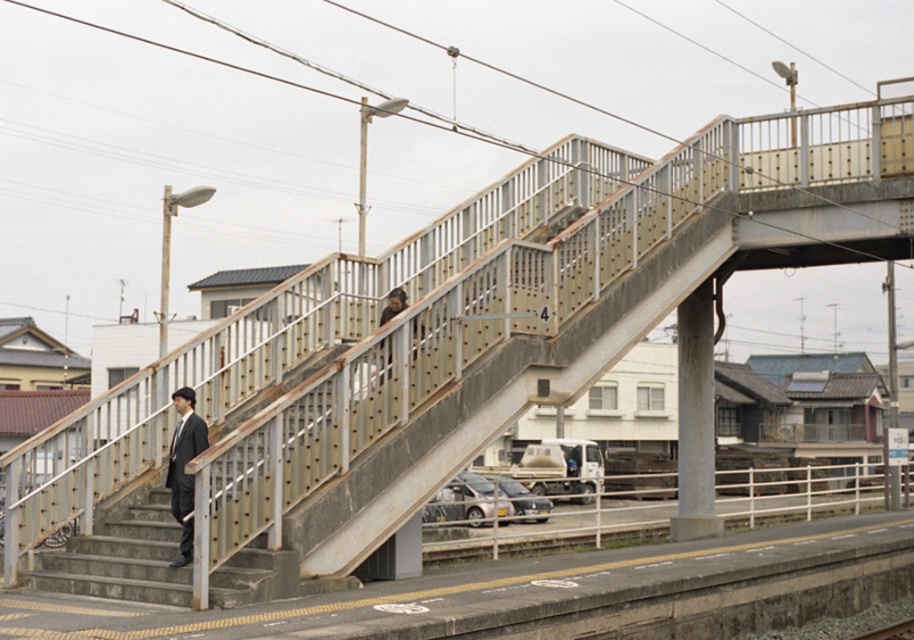
In the scene shown: Between dark gray suit at left and dark brown leather jacket at center, which one is positioned lower?

dark gray suit at left is below.

Does dark gray suit at left appear on the left side of dark brown leather jacket at center?

Correct, you'll find dark gray suit at left to the left of dark brown leather jacket at center.

Which is behind, point (174, 456) or point (406, 307)?

Point (406, 307)

Where is `dark gray suit at left`? This screenshot has height=640, width=914. dark gray suit at left is located at coordinates (183, 467).

Who is taller, rusty metal stairs at lower left or dark gray suit at left?

Standing taller between the two is dark gray suit at left.

Is rusty metal stairs at lower left smaller than dark gray suit at left?

No, rusty metal stairs at lower left is not smaller than dark gray suit at left.

Measure the distance between point [133,560] and camera.

Point [133,560] and camera are 48.90 feet apart from each other.

Image resolution: width=914 pixels, height=640 pixels. I want to click on rusty metal stairs at lower left, so click(x=122, y=557).

Between point (115, 544) and point (389, 342), which one is positioned behind?

The point (389, 342) is more distant.

This screenshot has width=914, height=640. I want to click on rusty metal stairs at lower left, so click(x=122, y=557).